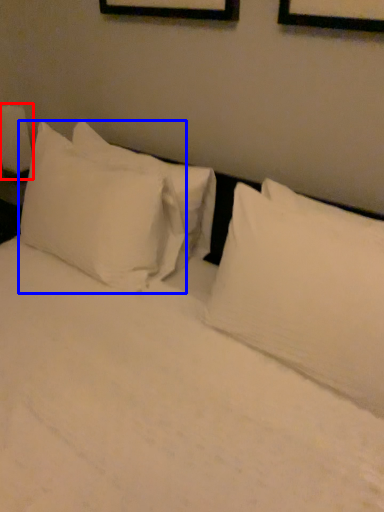
Question: Which of the following is the closest to the observer, bedside lamp (highlighted by a red box) or pillow (highlighted by a blue box)?

Choices:
 (A) bedside lamp
 (B) pillow

Answer: (B)